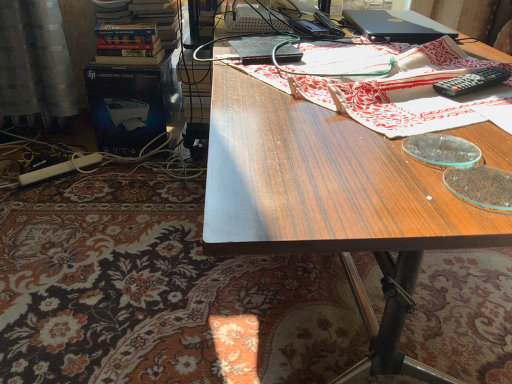
This screenshot has height=384, width=512. In order to click on vacant region to the left of wooden desk at center in this screenshot , I will do `click(117, 250)`.